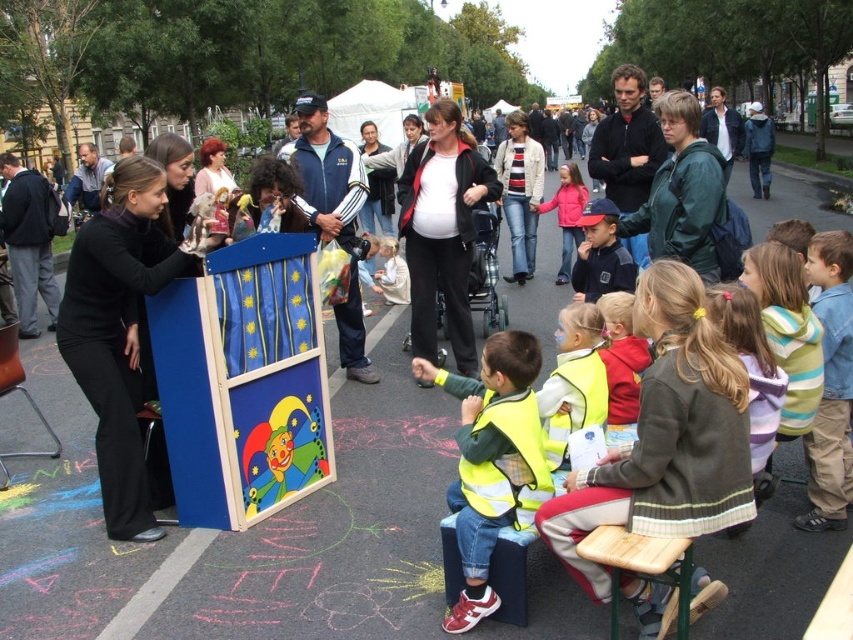
Based on the photo, you are a visitor at this event and want to take a photo of the wooden puppet show at center and the blue painted wooden podium at center. Which one should you focus on to ensure both are in the frame without moving your camera?

You should focus on the blue painted wooden podium at center because the wooden puppet show at center is in front of it, so keeping the podium in the frame will naturally include the puppet show as well.